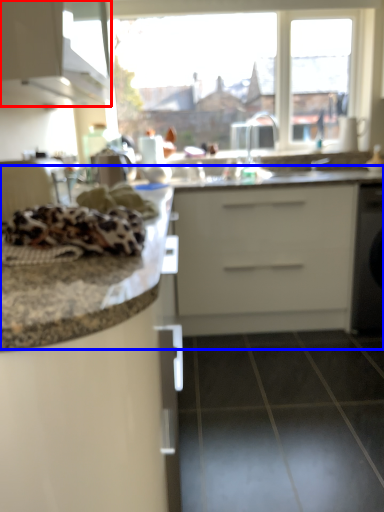
Question: Which object appears farthest to the camera in this image, cabinetry (highlighted by a red box) or counter top (highlighted by a blue box)?

Choices:
 (A) cabinetry
 (B) counter top

Answer: (B)